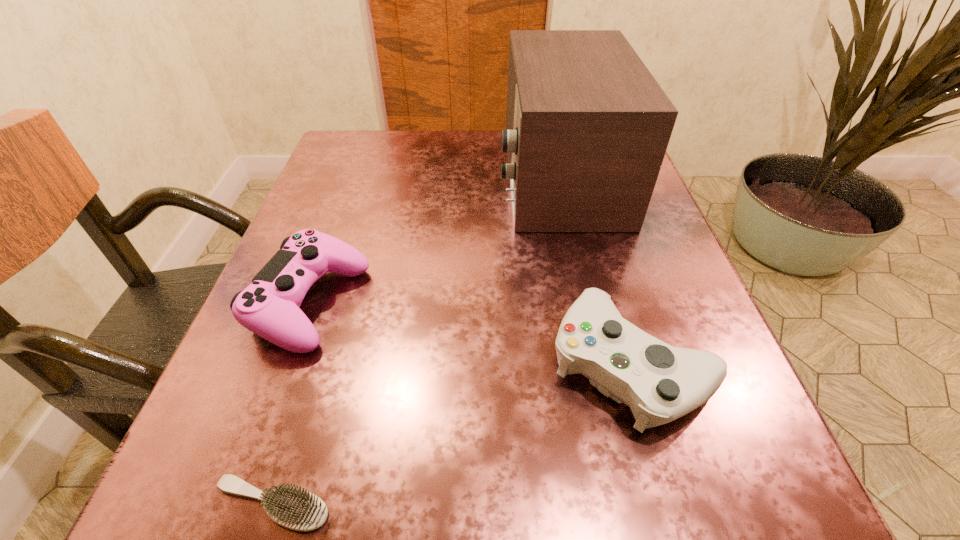
At what (x,y) coordinates should I click in order to perform the action: click on empty space between the shortest object and the tallest object. Please return your answer as a coordinate pair (x, y). The image size is (960, 540). Looking at the image, I should click on (415, 340).

The height and width of the screenshot is (540, 960). Find the location of `unoccupied position between the left control and the scrubbing brush`. unoccupied position between the left control and the scrubbing brush is located at coordinates 292,403.

This screenshot has width=960, height=540. In order to click on vacant space that is in between the scrubbing brush and the left control in this screenshot , I will do `click(292, 403)`.

Image resolution: width=960 pixels, height=540 pixels. Identify the location of free spot between the radio receiver and the left control. (434, 239).

You are a GUI agent. You are given a task and a screenshot of the screen. Output one action in this format:
    pyautogui.click(x=<x>, y=<y>)
    Task: Click on the vacant space in between the nearest object and the right control
    
    Given the screenshot: What is the action you would take?
    pyautogui.click(x=451, y=434)

The height and width of the screenshot is (540, 960). Identify the location of object that is the second closest to the right control. (297, 509).

Select which object appears as the second closest to the left control. Please provide its 2D coordinates. Your answer should be formatted as a tuple, i.e. [(x, y)], where the tuple contains the x and y coordinates of a point satisfying the conditions above.

[(587, 125)]

The width and height of the screenshot is (960, 540). In order to click on free space that satisfies the following two spatial constraints: 1. on the front side of the left control; 2. on the left side of the nearest object in this screenshot , I will do `click(238, 504)`.

The height and width of the screenshot is (540, 960). I want to click on free spot that satisfies the following two spatial constraints: 1. on the front-facing side of the right control; 2. on the right side of the farthest object, so click(x=600, y=363).

Find the location of a particular element. vacant area in the image that satisfies the following two spatial constraints: 1. on the front-facing side of the right control; 2. on the right side of the farthest object is located at coordinates (600, 363).